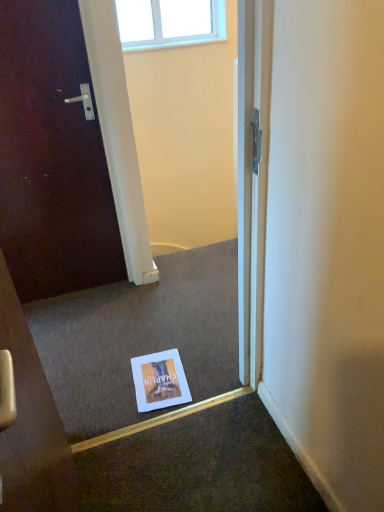
Question: Considering the positions of clear glass window at upper center and white paper flyer at center in the image, is clear glass window at upper center taller or shorter than white paper flyer at center?

Choices:
 (A) tall
 (B) short

Answer: (A)

Question: From the image's perspective, is clear glass window at upper center located above or below white paper flyer at center?

Choices:
 (A) below
 (B) above

Answer: (B)

Question: Would you say clear glass window at upper center is to the left or to the right of white paper flyer at center in the picture?

Choices:
 (A) right
 (B) left

Answer: (B)

Question: Is white paper flyer at center inside or outside of clear glass window at upper center?

Choices:
 (A) outside
 (B) inside

Answer: (A)

Question: From the image's perspective, relative to clear glass window at upper center, is white paper flyer at center above or below?

Choices:
 (A) above
 (B) below

Answer: (B)

Question: In the image, is white paper flyer at center positioned in front of or behind clear glass window at upper center?

Choices:
 (A) front
 (B) behind

Answer: (A)

Question: In terms of size, does white paper flyer at center appear bigger or smaller than clear glass window at upper center?

Choices:
 (A) big
 (B) small

Answer: (B)